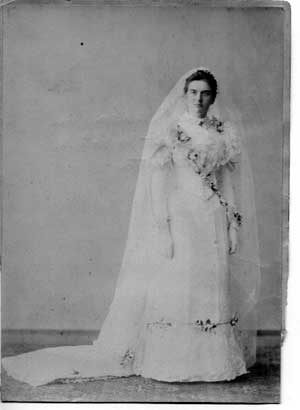
Locate an element on the screen. This screenshot has width=300, height=410. embroidery is located at coordinates (182, 136), (193, 157), (212, 185), (237, 214), (206, 324), (156, 324), (233, 322).